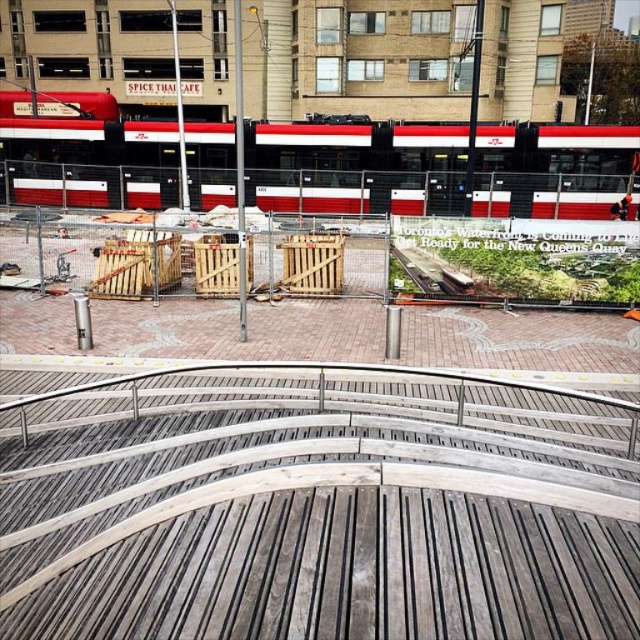
You are standing at point [314,500] in the urban scene. What object is located exactly at your current position?

At point [314,500] lies wooden crates at center.

You are a delivery person trying to navigate through the urban scene. You need to move a large box that is 2 meters wide. There is a path between the wooden crates at center and the red and white metal passenger train at upper center. Can you pass through this path with your box?

The wooden crates at center has a lesser width compared to the red and white metal passenger train at upper center. Since the wooden crates are narrower, the path between them and the train might be wide enough for the 2m box. However, without exact path width, it is uncertain. Check the space carefully before moving.